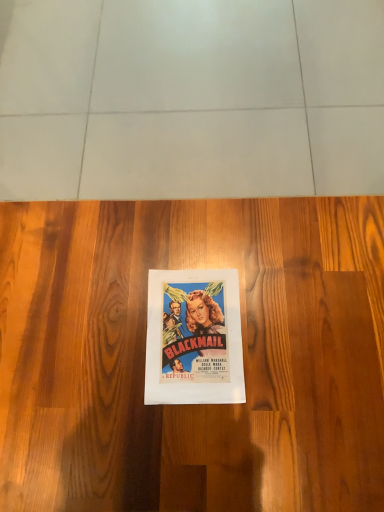
The image size is (384, 512). Find the location of `vacant area on top of matte paper poster at center (from a real-world perspective)`. vacant area on top of matte paper poster at center (from a real-world perspective) is located at coordinates (200, 342).